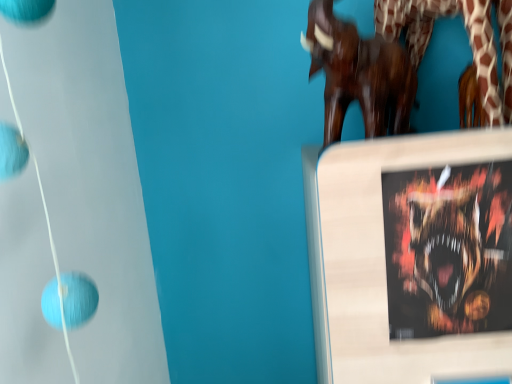
The image size is (512, 384). What are the coordinates of `shiny metallic poster at upper right` in the screenshot? It's located at (448, 249).

Measure the distance between shiny metallic poster at upper right and camera.

62.30 centimeters.

What do you see at coordinates (448, 249) in the screenshot?
I see `shiny metallic poster at upper right` at bounding box center [448, 249].

You are a GUI agent. You are given a task and a screenshot of the screen. Output one action in this format:
    pyautogui.click(x=<x>, y=<y>)
    Task: Click on the wooden sculpture at upper right
    The height and width of the screenshot is (384, 512).
    Given the screenshot: What is the action you would take?
    pyautogui.click(x=359, y=75)

The height and width of the screenshot is (384, 512). What do you see at coordinates (359, 75) in the screenshot? I see `wooden sculpture at upper right` at bounding box center [359, 75].

Where is `shiny metallic poster at upper right`? The width and height of the screenshot is (512, 384). shiny metallic poster at upper right is located at coordinates (448, 249).

Would you say wooden sculpture at upper right is to the left or to the right of shiny metallic poster at upper right in the picture?

wooden sculpture at upper right is positioned on shiny metallic poster at upper right's left side.

Based on the photo, is wooden sculpture at upper right in front of or behind shiny metallic poster at upper right in the image?

Visually, wooden sculpture at upper right is located behind shiny metallic poster at upper right.

Is point (339, 24) positioned behind point (422, 222)?

That is True.

From the image's perspective, which object appears higher, wooden sculpture at upper right or shiny metallic poster at upper right?

wooden sculpture at upper right is shown above in the image.

From a real-world perspective, is wooden sculpture at upper right beneath shiny metallic poster at upper right?

No.

Which of these two, wooden sculpture at upper right or shiny metallic poster at upper right, is wider?

wooden sculpture at upper right is wider.

Who is taller, wooden sculpture at upper right or shiny metallic poster at upper right?

shiny metallic poster at upper right is taller.

Between wooden sculpture at upper right and shiny metallic poster at upper right, which one has smaller size?

Smaller between the two is shiny metallic poster at upper right.

Is wooden sculpture at upper right situated inside shiny metallic poster at upper right or outside?

wooden sculpture at upper right is located beyond the bounds of shiny metallic poster at upper right.

Are wooden sculpture at upper right and shiny metallic poster at upper right beside each other?

wooden sculpture at upper right and shiny metallic poster at upper right are not in contact.

Is shiny metallic poster at upper right at the back of wooden sculpture at upper right?

No.

The image size is (512, 384). I want to click on animal to the right of wooden sculpture at upper right, so click(448, 249).

Considering the positions of objects shiny metallic poster at upper right and wooden sculpture at upper right in the image provided, who is more to the right, shiny metallic poster at upper right or wooden sculpture at upper right?

From the viewer's perspective, shiny metallic poster at upper right appears more on the right side.

Between shiny metallic poster at upper right and wooden sculpture at upper right, which one is positioned in front?

shiny metallic poster at upper right is in front.

Which is behind, point (449, 308) or point (350, 99)?

The point (350, 99) is more distant.

From the image's perspective, which one is positioned lower, shiny metallic poster at upper right or wooden sculpture at upper right?

shiny metallic poster at upper right, from the image's perspective.

From a real-world perspective, is shiny metallic poster at upper right on top of wooden sculpture at upper right?

Incorrect, from a real-world perspective, shiny metallic poster at upper right is lower than wooden sculpture at upper right.

Based on the photo, between shiny metallic poster at upper right and wooden sculpture at upper right, which one has smaller width?

With smaller width is shiny metallic poster at upper right.

Consider the image. Which of these two, shiny metallic poster at upper right or wooden sculpture at upper right, stands shorter?

wooden sculpture at upper right is shorter.

Considering the sizes of objects shiny metallic poster at upper right and wooden sculpture at upper right in the image provided, who is bigger, shiny metallic poster at upper right or wooden sculpture at upper right?

Bigger between the two is wooden sculpture at upper right.

Is shiny metallic poster at upper right not inside wooden sculpture at upper right?

Yes, shiny metallic poster at upper right is located beyond the bounds of wooden sculpture at upper right.

Can you see shiny metallic poster at upper right touching wooden sculpture at upper right?

shiny metallic poster at upper right is not next to wooden sculpture at upper right, and they're not touching.

Is shiny metallic poster at upper right oriented away from wooden sculpture at upper right?

No, shiny metallic poster at upper right's orientation is not away from wooden sculpture at upper right.

What's the angular difference between shiny metallic poster at upper right and wooden sculpture at upper right's facing directions?

5.11 degrees.

Find the location of a particular element. The height and width of the screenshot is (384, 512). animal in front of the wooden sculpture at upper right is located at coordinates (448, 249).

Image resolution: width=512 pixels, height=384 pixels. I want to click on sculpture above the shiny metallic poster at upper right (from the image's perspective), so click(x=359, y=75).

Where is `animal that is under the wooden sculpture at upper right (from a real-world perspective)`? The width and height of the screenshot is (512, 384). animal that is under the wooden sculpture at upper right (from a real-world perspective) is located at coordinates (448, 249).